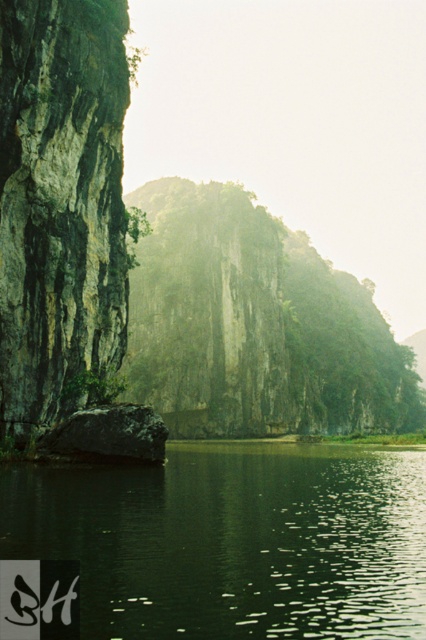
In the scene shown: You are an environmental scientist assessing the area. You need to determine which area is more suitable for setting up a temporary research station. The station requires a flat and stable surface. Based on the scene, which object would you choose between the green smooth water at center and the green rough rock at left?

The green smooth water at center is larger in size than the green rough rock at left, making it more suitable for a temporary research station as it provides a flatter and more stable surface compared to the rough rock.

You are standing at the edge of the scene and want to cross to the other side. You have two options to choose from the image. One is the green smooth water at center and the other is the green rough rock at center. Which path would you choose and why?

You should choose the green rough rock at center because it occupies more space than the green smooth water at center, making it a more stable and safer path to cross.